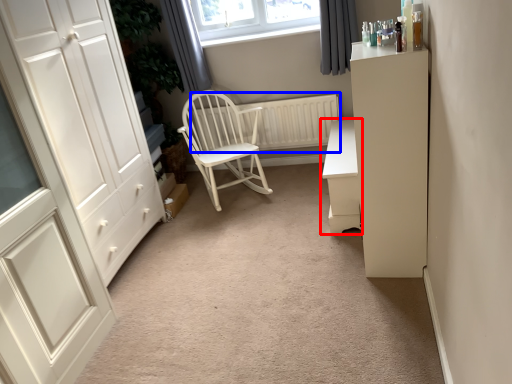
Question: Which point is closer to the camera, chest of drawers (highlighted by a red box) or radiator (highlighted by a blue box)?

Choices:
 (A) chest of drawers
 (B) radiator

Answer: (A)